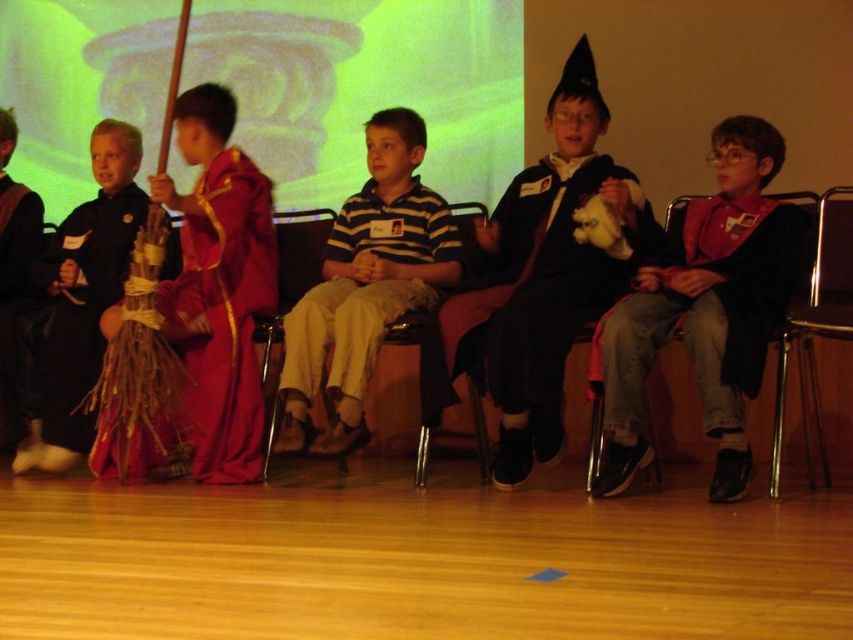
You are a photographer setting up for a school play. You need to ensure that the striped cotton shirt at center and the metallic silver chair at right are both visible in your shot. Given their heights, which object will appear taller in the photo?

The striped cotton shirt at center will appear taller in the photo since it has a greater height compared to the metallic silver chair at right.

You are standing on the stage and want to place a small prop on the floor between the two points labeled point [82,289] and point [672,209]. Which point is closer to you so you can reach it easily?

Point [82,289] is closer to you than point [672,209], so you can reach it more easily.

You are a costume designer observing the stage setup. The matte black jacket at right and the velvet maroon robe at left are part of the costume designs. Which costume is taller when viewed from the audience perspective?

The matte black jacket at right is taller than the velvet maroon robe at left.